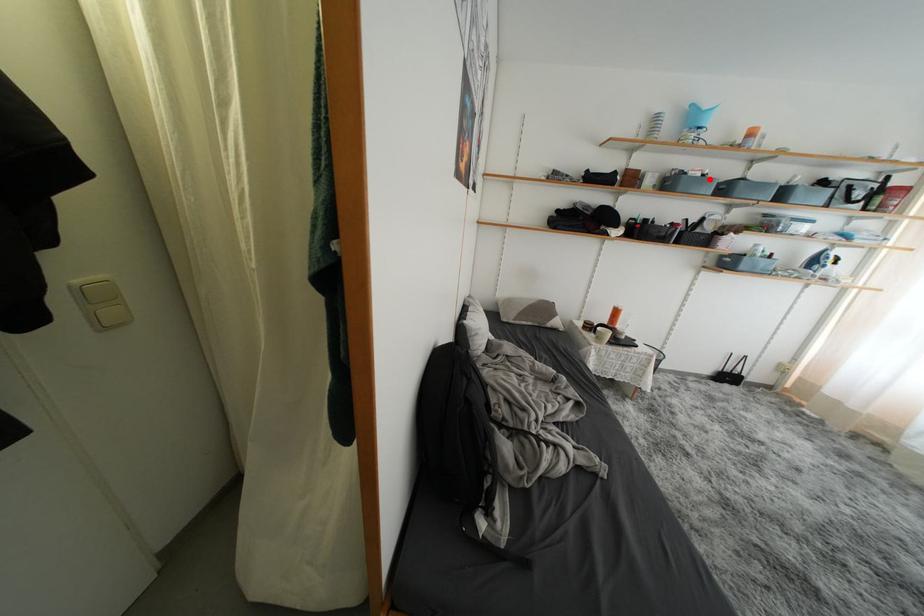
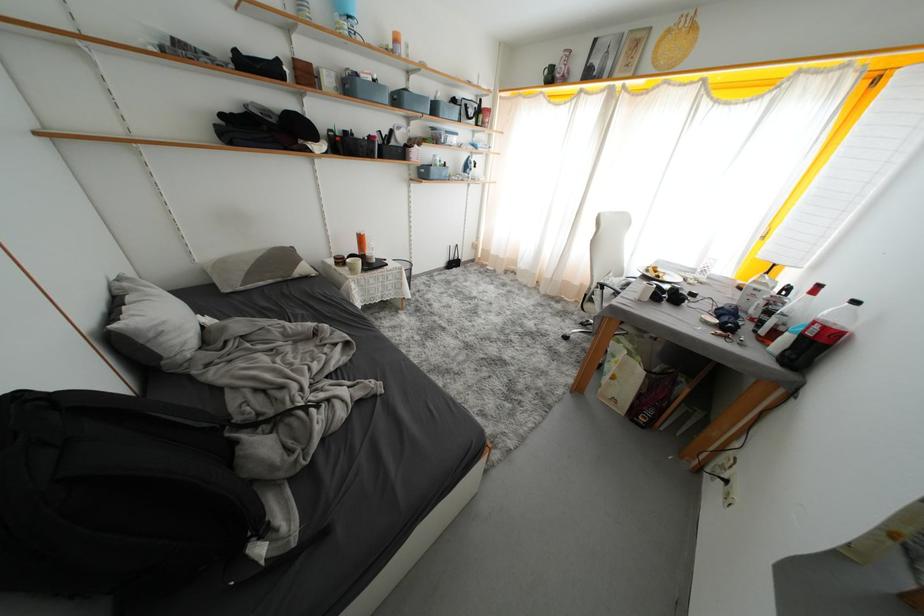
Find the pixel in the second image that matches the highlighted location in the first image.

(381, 84)